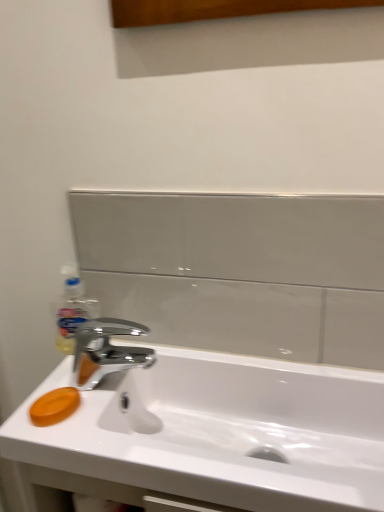
Identify the location of free spot in front of translucent plastic soap dispenser at left. The image size is (384, 512). (70, 414).